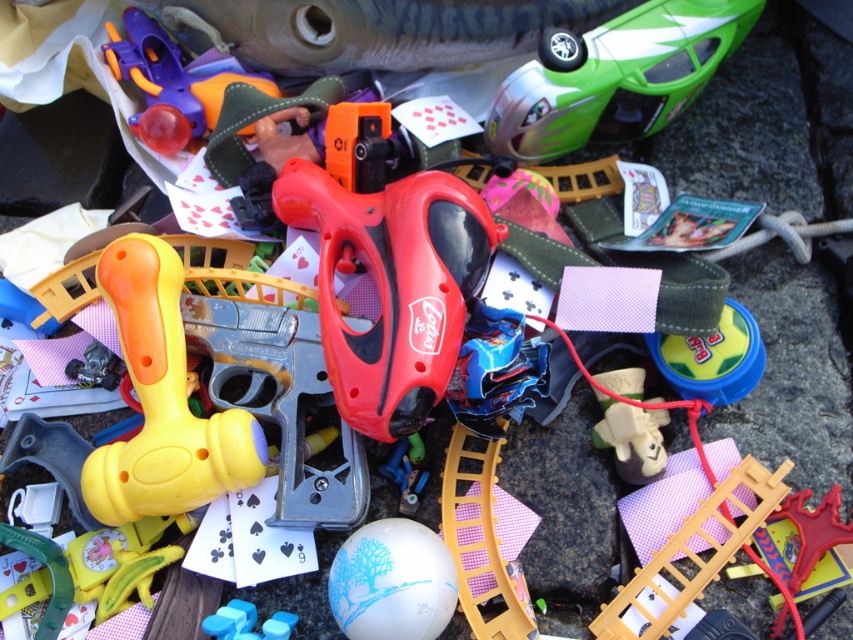
Is point (367, 221) positioned before point (387, 548)?

No.

Does point (300, 164) come behind point (418, 586)?

That is True.

You are a GUI agent. You are given a task and a screenshot of the screen. Output one action in this format:
    pyautogui.click(x=<x>, y=<y>)
    Task: Click on the rubberized plastic toy gun at center
    The height and width of the screenshot is (640, 853).
    Given the screenshot: What is the action you would take?
    pyautogui.click(x=392, y=285)

Can you confirm if yellow plastic hammer at center-left is smaller than white matte ball at center?

Incorrect, yellow plastic hammer at center-left is not smaller in size than white matte ball at center.

This screenshot has width=853, height=640. Describe the element at coordinates (161, 401) in the screenshot. I see `yellow plastic hammer at center-left` at that location.

You are a GUI agent. You are given a task and a screenshot of the screen. Output one action in this format:
    pyautogui.click(x=<x>, y=<y>)
    Task: Click on the yellow plastic hammer at center-left
    The width and height of the screenshot is (853, 640).
    Given the screenshot: What is the action you would take?
    pyautogui.click(x=161, y=401)

Where is `yellow plastic hammer at center-left`? The height and width of the screenshot is (640, 853). yellow plastic hammer at center-left is located at coordinates (161, 401).

You are a GUI agent. You are given a task and a screenshot of the screen. Output one action in this format:
    pyautogui.click(x=<x>, y=<y>)
    Task: Click on the yellow plastic hammer at center-left
    
    Given the screenshot: What is the action you would take?
    pyautogui.click(x=161, y=401)

Which is in front, point (199, 433) or point (595, 97)?

Point (199, 433) is in front.

The height and width of the screenshot is (640, 853). What are the coordinates of `yellow plastic hammer at center-left` in the screenshot? It's located at (161, 401).

The width and height of the screenshot is (853, 640). Identify the location of yellow plastic hammer at center-left. (161, 401).